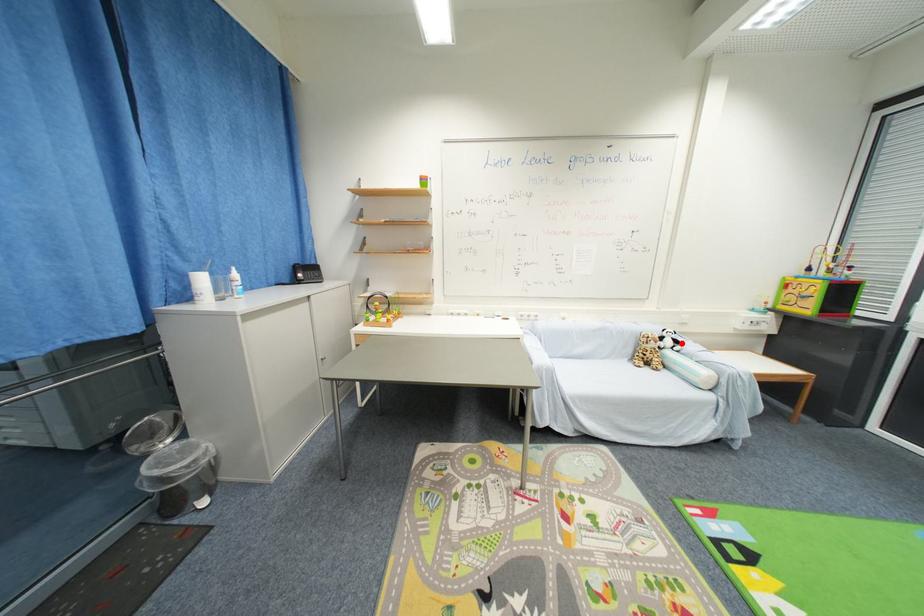
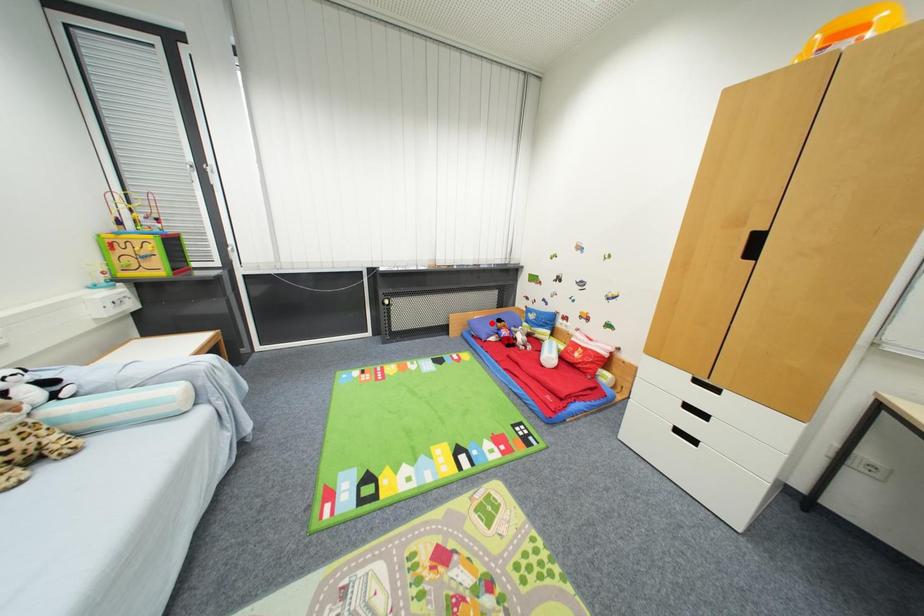
I am providing you with two images of the same scene from different viewpoints. A red point is marked on the first image and another point is marked on the second image. Are the points marked in image1 and image2 representing the same 3D position?

No